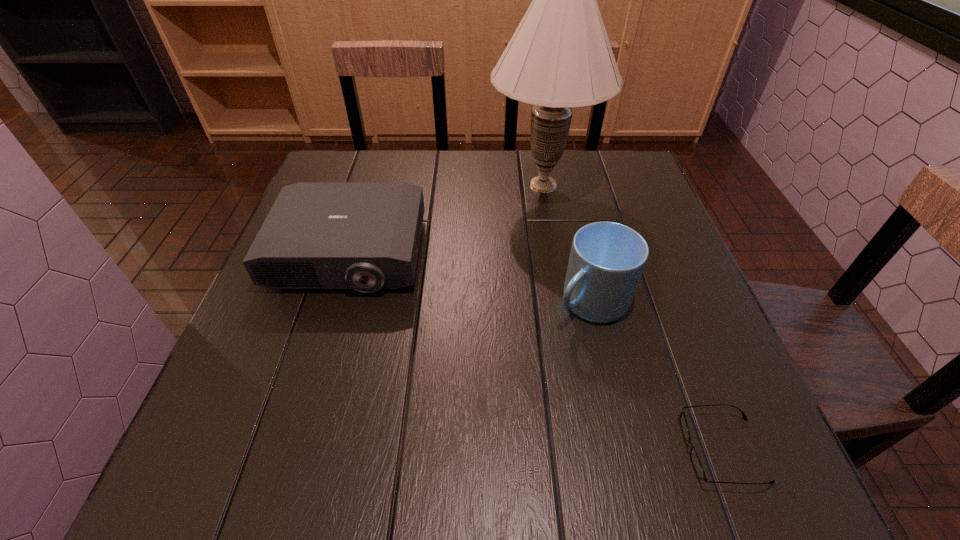
Identify the location of vacant region at the far edge of the desktop. (506, 160).

Where is `blank space at the near edge of the desktop`? The image size is (960, 540). blank space at the near edge of the desktop is located at coordinates (638, 441).

This screenshot has width=960, height=540. I want to click on vacant space at the left edge of the desktop, so click(x=259, y=349).

At what (x,y) coordinates should I click in order to perform the action: click on free spot at the right edge of the desktop. Please return your answer as a coordinate pair (x, y). This screenshot has width=960, height=540. Looking at the image, I should click on (689, 374).

Where is `vacant region at the far left corner of the desktop`? The width and height of the screenshot is (960, 540). vacant region at the far left corner of the desktop is located at coordinates (330, 158).

Image resolution: width=960 pixels, height=540 pixels. I want to click on free region at the near left corner of the desktop, so click(x=283, y=476).

You are a GUI agent. You are given a task and a screenshot of the screen. Output one action in this format:
    pyautogui.click(x=<x>, y=<y>)
    Task: Click on the vacant space at the far right corner of the desktop
    The width and height of the screenshot is (960, 540).
    Given the screenshot: What is the action you would take?
    pyautogui.click(x=634, y=160)

The width and height of the screenshot is (960, 540). In order to click on free area in between the mug and the projector in this screenshot , I will do pos(470,278).

You are a GUI agent. You are given a task and a screenshot of the screen. Output one action in this format:
    pyautogui.click(x=<x>, y=<y>)
    Task: Click on the free point between the tallest object and the rightmost object
    This screenshot has height=540, width=960.
    Given the screenshot: What is the action you would take?
    pyautogui.click(x=633, y=317)

Identify the location of vacant space in between the leftmost object and the mug. The image size is (960, 540). (470, 278).